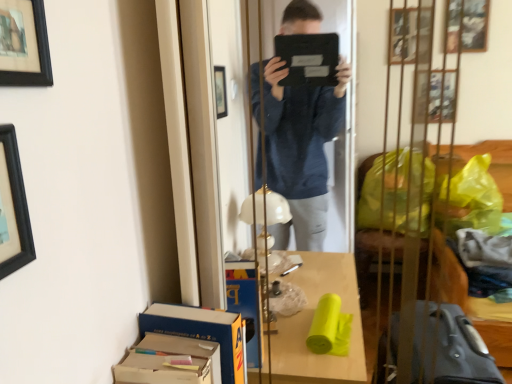
Question: Looking at the image, does cardboard box at lower left, which ranks as the first cardboard box in front-to-back order, seem bigger or smaller compared to black matte picture frame at upper left, the first picture frame positioned from the bottom?

Choices:
 (A) small
 (B) big

Answer: (B)

Question: In terms of width, does cardboard box at lower left, arranged as the 2th cardboard box when viewed from the back, look wider or thinner when compared to black matte picture frame at upper left, the first picture frame positioned from the bottom?

Choices:
 (A) thin
 (B) wide

Answer: (B)

Question: Which is nearer to the black matte picture frame at upper left, acting as the second picture frame starting from the top?

Choices:
 (A) black matte picture frame at upper left, acting as the 2th picture frame starting from the bottom
 (B) cardboard box at lower left, the 1th cardboard box when ordered from back to front
 (C) cardboard box at lower left, arranged as the 2th cardboard box when viewed from the back

Answer: (A)

Question: Considering the real-world distances, which object is farthest from the cardboard box at lower left, the 1th cardboard box when ordered from back to front?

Choices:
 (A) black matte picture frame at upper left, which appears as the 1th picture frame when viewed from the top
 (B) black matte picture frame at upper left, the first picture frame positioned from the bottom
 (C) cardboard box at lower left, arranged as the 2th cardboard box when viewed from the back

Answer: (A)